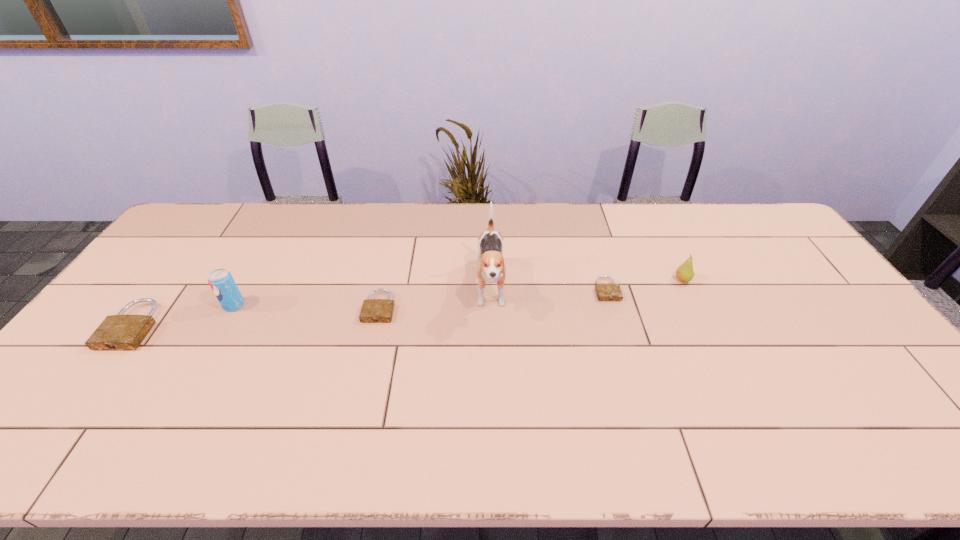
Considering the uniform spacing of padlocks, where should an additional padlock be positioned on the right? Please locate a free spot. Please provide its 2D coordinates. Your answer should be formatted as a tuple, i.e. [(x, y)], where the tuple contains the x and y coordinates of a point satisfying the conditions above.

[(817, 273)]